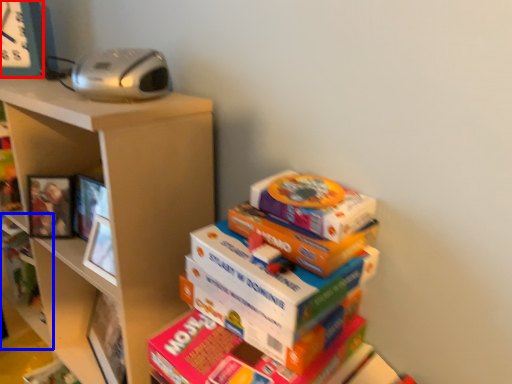
Question: Which object is closer to the camera taking this photo, clock (highlighted by a red box) or shelf (highlighted by a blue box)?

Choices:
 (A) clock
 (B) shelf

Answer: (A)